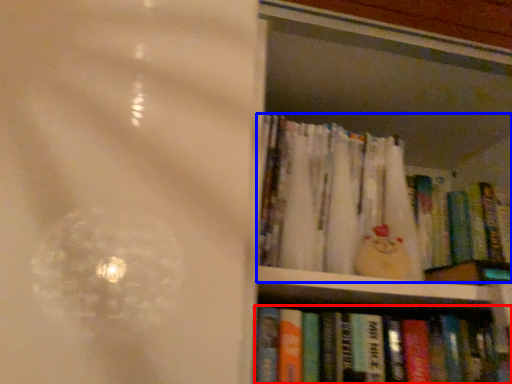
Question: Among these objects, which one is farthest to the camera, book (highlighted by a red box) or book (highlighted by a blue box)?

Choices:
 (A) book
 (B) book

Answer: (B)